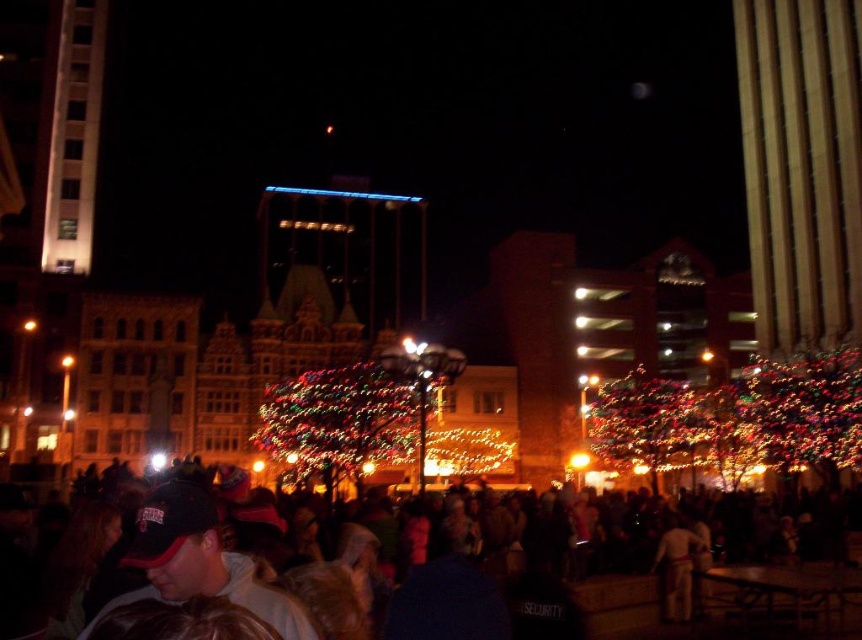
You are a photographer trying to capture a photo of the illuminated plastic tree at center and the light brown leather jacket at lower right. To ensure both are in frame, should you adjust your camera to focus on the left or the right side of the scene?

The illuminated plastic tree at center is positioned on the left side of the light brown leather jacket at lower right. Therefore, to include both in the frame, you should focus on the left side where the illuminated plastic tree at center is located and the right side where the light brown leather jacket at lower right is positioned.

You are standing in the public square and want to take a photo of the illuminated glass tree at center without anyone blocking the view. Since the light brown leather jacket at lower right is in the way, can you just move to the left to avoid it?

The illuminated glass tree at center is located above the light brown leather jacket at lower right, so moving to the left might not help because the jacket is below the tree. You might need to move to the right or adjust your angle to ensure the tree is visible without obstruction.